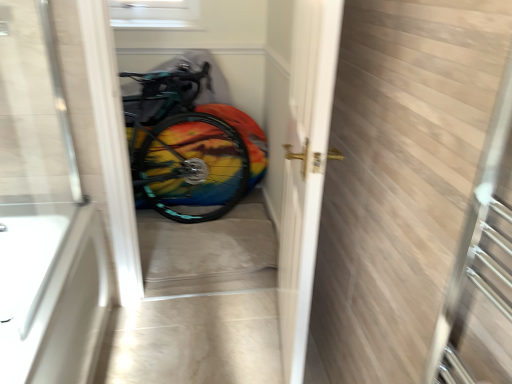
Question: From the image's perspective, is multicolored fabric at center on rainbow painted bicycle at center?

Choices:
 (A) no
 (B) yes

Answer: (A)

Question: Can you confirm if multicolored fabric at center is wider than rainbow painted bicycle at center?

Choices:
 (A) yes
 (B) no

Answer: (A)

Question: Is multicolored fabric at center smaller than rainbow painted bicycle at center?

Choices:
 (A) yes
 (B) no

Answer: (A)

Question: Is multicolored fabric at center at the left side of rainbow painted bicycle at center?

Choices:
 (A) yes
 (B) no

Answer: (B)

Question: Is multicolored fabric at center far from rainbow painted bicycle at center?

Choices:
 (A) yes
 (B) no

Answer: (B)

Question: Considering the positions of rainbow painted bicycle at center and white glossy door handle at center in the image, is rainbow painted bicycle at center taller or shorter than white glossy door handle at center?

Choices:
 (A) short
 (B) tall

Answer: (A)

Question: From a real-world perspective, is rainbow painted bicycle at center positioned above or below white glossy door handle at center?

Choices:
 (A) below
 (B) above

Answer: (A)

Question: In terms of size, does rainbow painted bicycle at center appear bigger or smaller than white glossy door handle at center?

Choices:
 (A) small
 (B) big

Answer: (A)

Question: From the image's perspective, relative to white glossy door handle at center, is rainbow painted bicycle at center above or below?

Choices:
 (A) above
 (B) below

Answer: (A)

Question: Is white glossy door handle at center wider or thinner than rainbow painted bicycle at center?

Choices:
 (A) thin
 (B) wide

Answer: (B)

Question: Considering the positions of point (298, 291) and point (184, 170), is point (298, 291) closer or farther from the camera than point (184, 170)?

Choices:
 (A) closer
 (B) farther

Answer: (A)

Question: From the image's perspective, is white glossy door handle at center located above or below rainbow painted bicycle at center?

Choices:
 (A) above
 (B) below

Answer: (B)

Question: From a real-world perspective, relative to rainbow painted bicycle at center, is white glossy door handle at center vertically above or below?

Choices:
 (A) above
 (B) below

Answer: (A)

Question: In terms of size, does multicolored fabric at center appear bigger or smaller than transparent glass door at left?

Choices:
 (A) small
 (B) big

Answer: (B)

Question: Based on their positions, is multicolored fabric at center located to the left or right of transparent glass door at left?

Choices:
 (A) right
 (B) left

Answer: (A)